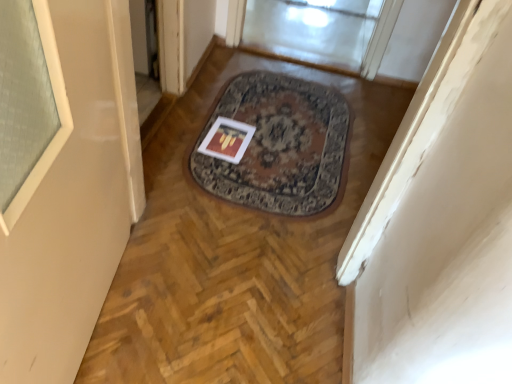
Question: From a real-world perspective, is matte paper postcard at center on transparent glass door at upper center?

Choices:
 (A) no
 (B) yes

Answer: (A)

Question: Considering the relative sizes of matte paper postcard at center and transparent glass door at upper center in the image provided, is matte paper postcard at center smaller than transparent glass door at upper center?

Choices:
 (A) yes
 (B) no

Answer: (A)

Question: Is matte paper postcard at center behind transparent glass door at upper center?

Choices:
 (A) no
 (B) yes

Answer: (A)

Question: Is matte paper postcard at center thinner than transparent glass door at upper center?

Choices:
 (A) no
 (B) yes

Answer: (B)

Question: Is matte paper postcard at center positioned in front of transparent glass door at upper center?

Choices:
 (A) yes
 (B) no

Answer: (A)

Question: Considering the relative sizes of matte paper postcard at center and transparent glass door at upper center in the image provided, is matte paper postcard at center shorter than transparent glass door at upper center?

Choices:
 (A) no
 (B) yes

Answer: (B)

Question: Can you confirm if transparent glass door at upper center is positioned to the right of matte paper postcard at center?

Choices:
 (A) no
 (B) yes

Answer: (B)

Question: From the image's perspective, is transparent glass door at upper center below matte paper postcard at center?

Choices:
 (A) yes
 (B) no

Answer: (B)

Question: Is the position of transparent glass door at upper center more distant than that of matte paper postcard at center?

Choices:
 (A) yes
 (B) no

Answer: (A)

Question: Is transparent glass door at upper center at the left side of matte paper postcard at center?

Choices:
 (A) no
 (B) yes

Answer: (A)

Question: Does transparent glass door at upper center have a greater width compared to matte paper postcard at center?

Choices:
 (A) no
 (B) yes

Answer: (B)

Question: Is transparent glass door at upper center facing towards matte paper postcard at center?

Choices:
 (A) yes
 (B) no

Answer: (A)

Question: Would you say matte paper postcard at center is to the left or to the right of transparent glass door at upper center in the picture?

Choices:
 (A) right
 (B) left

Answer: (B)